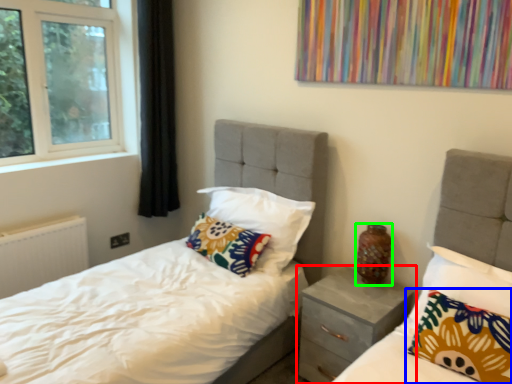
Question: Which object is the farthest from nightstand (highlighted by a red box)? Choose among these: pillow (highlighted by a blue box) or vase (highlighted by a green box).

Choices:
 (A) pillow
 (B) vase

Answer: (A)